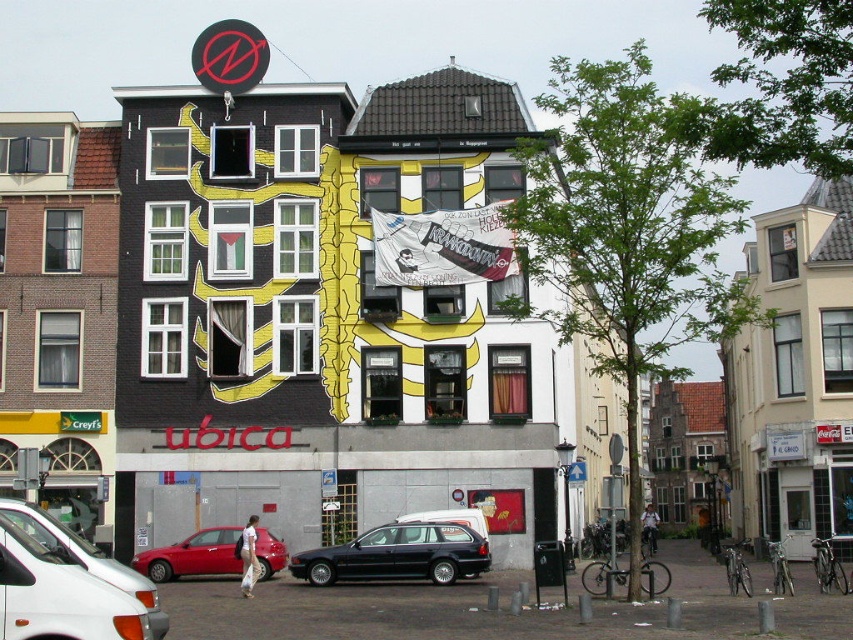
You are a delivery person needing to park your vehicle in a tight space. You have a metallic dark blue wagon at center and a shiny red sedan at lower left. Which vehicle would you choose to park in the narrow space?

The shiny red sedan at lower left has a narrower width than the metallic dark blue wagon at center, so it would be better to choose the shiny red sedan at lower left for parking in the narrow space.

You are standing at the white matte van at lower left and want to take a photo of the circular logo at the top of the building. The camera you have can focus on objects up to 40 meters away. Will the circular logo be in focus?

The white matte van at lower left and camera are 38.38 meters apart from each other. Since the camera can focus up to 40 meters, the circular logo at the top of the building will be within the focus range and should be in focus.

You are a delivery person needing to park your vehicle near the building with the red logo. The parking spot is right in front of the metallic dark blue wagon at center. Can you safely park your shiny red sedan at lower left there without blocking the wagon?

The metallic dark blue wagon at center is closer to the viewer than the shiny red sedan at lower left. Since the parking spot is in front of the wagon, the sedan would be behind it and not blocking the wagon.